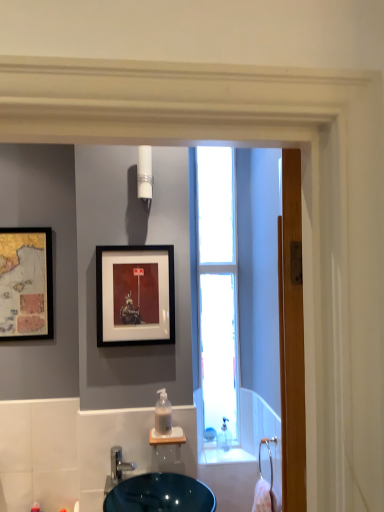
The height and width of the screenshot is (512, 384). Describe the element at coordinates (135, 295) in the screenshot. I see `matte black picture frame at center, which appears as the second picture frame when viewed from the left` at that location.

Measure the distance between point (121,248) and camera.

The depth of point (121,248) is 6.08 feet.

What do you see at coordinates (258, 271) in the screenshot? This screenshot has height=512, width=384. I see `wooden screen door at right` at bounding box center [258, 271].

You are a GUI agent. You are given a task and a screenshot of the screen. Output one action in this format:
    pyautogui.click(x=<x>, y=<y>)
    Task: Click on the white glossy light fixture at upper center
    
    Given the screenshot: What is the action you would take?
    pyautogui.click(x=145, y=176)

Describe the element at coordinates (117, 469) in the screenshot. I see `satin nickel faucet at lower center` at that location.

Where is `matte black picture frame at center, arranged as the 1th picture frame when viewed from the right`? The height and width of the screenshot is (512, 384). matte black picture frame at center, arranged as the 1th picture frame when viewed from the right is located at coordinates (135, 295).

From the image's perspective, is white glossy light fixture at upper center located above or below matte black picture frame at center, marked as the 1th picture frame in a front-to-back arrangement?

Clearly, from the image's perspective, white glossy light fixture at upper center is above matte black picture frame at center, marked as the 1th picture frame in a front-to-back arrangement.

How different are the orientations of white glossy light fixture at upper center and matte black picture frame at center, the second picture frame when ordered from back to front, in degrees?

There is a 4.11-degree angle between the facing directions of white glossy light fixture at upper center and matte black picture frame at center, the second picture frame when ordered from back to front.

Are white glossy light fixture at upper center and matte black picture frame at center, which appears as the second picture frame when viewed from the left, beside each other?

There is a gap between white glossy light fixture at upper center and matte black picture frame at center, which appears as the second picture frame when viewed from the left.

From the picture: Is white glossy light fixture at upper center to the right of matte black picture frame at center, the second picture frame when ordered from back to front, from the viewer's perspective?

Yes, white glossy light fixture at upper center is to the right of matte black picture frame at center, the second picture frame when ordered from back to front.

From the image's perspective, is satin nickel faucet at lower center under matte black picture frame at center, arranged as the 1th picture frame when viewed from the right?

Yes, from the image's perspective, satin nickel faucet at lower center is below matte black picture frame at center, arranged as the 1th picture frame when viewed from the right.

Which is less distant, (114,475) or (161,313)?

The point (114,475) is closer.

Is satin nickel faucet at lower center outside of matte black picture frame at center, which appears as the second picture frame when viewed from the left?

Indeed, satin nickel faucet at lower center is completely outside matte black picture frame at center, which appears as the second picture frame when viewed from the left.

Would you say satin nickel faucet at lower center is a long distance from matte black picture frame at center, which appears as the second picture frame when viewed from the left?

satin nickel faucet at lower center is actually quite close to matte black picture frame at center, which appears as the second picture frame when viewed from the left.

From the image's perspective, who appears lower, satin nickel faucet at lower center or clear plastic soap dispenser at center?

satin nickel faucet at lower center is shown below in the image.

Is satin nickel faucet at lower center inside or outside of clear plastic soap dispenser at center?

satin nickel faucet at lower center is located beyond the bounds of clear plastic soap dispenser at center.

How many degrees apart are the facing directions of satin nickel faucet at lower center and clear plastic soap dispenser at center?

The facing directions of satin nickel faucet at lower center and clear plastic soap dispenser at center are 0.651 degrees apart.

Looking at the image, does satin nickel faucet at lower center seem bigger or smaller compared to clear plastic soap dispenser at center?

satin nickel faucet at lower center is bigger than clear plastic soap dispenser at center.

Is matte black picture frame at center, marked as the 1th picture frame in a front-to-back arrangement, wider than wooden screen door at right?

No.

Which object is further away from the camera, matte black picture frame at center, which appears as the second picture frame when viewed from the left, or wooden screen door at right?

matte black picture frame at center, which appears as the second picture frame when viewed from the left.

In the scene shown: How far apart are matte black picture frame at center, arranged as the 1th picture frame when viewed from the right, and wooden screen door at right?

matte black picture frame at center, arranged as the 1th picture frame when viewed from the right, and wooden screen door at right are 21.81 inches apart from each other.

From a real-world perspective, is matte black picture frame at center, which appears as the second picture frame when viewed from the left, over wooden screen door at right?

Yes, from a real-world perspective, matte black picture frame at center, which appears as the second picture frame when viewed from the left, is over wooden screen door at right

Is matte black picture frame at center, the second picture frame when ordered from back to front, oriented towards transparent glass window at center?

No, matte black picture frame at center, the second picture frame when ordered from back to front, is not turned towards transparent glass window at center.

Considering the positions of points (173, 262) and (232, 369), is point (173, 262) farther from camera compared to point (232, 369)?

No, it is not.

From the image's perspective, which one is positioned higher, matte black picture frame at center, the second picture frame when ordered from back to front, or transparent glass window at center?

transparent glass window at center, from the image's perspective.

Considering the positions of objects matte black picture frame at center, the second picture frame when ordered from back to front, and transparent glass window at center in the image provided, who is more to the right, matte black picture frame at center, the second picture frame when ordered from back to front, or transparent glass window at center?

transparent glass window at center is more to the right.

Consider the image. Is white glossy light fixture at upper center far from clear plastic soap dispenser at center?

That's not correct — white glossy light fixture at upper center is a little close to clear plastic soap dispenser at center.

Can you confirm if white glossy light fixture at upper center is bigger than clear plastic soap dispenser at center?

Correct, white glossy light fixture at upper center is larger in size than clear plastic soap dispenser at center.

Which of these two, white glossy light fixture at upper center or clear plastic soap dispenser at center, is wider?

Wider between the two is clear plastic soap dispenser at center.

The image size is (384, 512). In order to click on window behind the gold metallic map at left, the second picture frame from the front in this screenshot , I will do `click(217, 288)`.

Is gold metallic map at left, which is the 1th picture frame from back to front, oriented away from transparent glass window at center?

No.

From the image's perspective, which one is positioned lower, gold metallic map at left, which is the 1th picture frame in left-to-right order, or transparent glass window at center?

From the image's view, gold metallic map at left, which is the 1th picture frame in left-to-right order, is below.

The height and width of the screenshot is (512, 384). I want to click on the 2nd picture frame below the white glossy light fixture at upper center (from the image's perspective), so pos(135,295).

From a real-world perspective, count 1st picture frames upward from the satin nickel faucet at lower center and point to it. Please provide its 2D coordinates.

[(135, 295)]

Which object lies further to the anchor point wooden screen door at right, transparent glass window at center or clear plastic soap dispenser at center?

clear plastic soap dispenser at center is further to wooden screen door at right.

From the image, which object appears to be nearer to transparent glass window at center, satin nickel faucet at lower center or wooden screen door at right?

The object closer to transparent glass window at center is wooden screen door at right.

When comparing their distances from matte black picture frame at center, which appears as the second picture frame when viewed from the left, does satin nickel faucet at lower center or transparent glass window at center seem further?

The object further to matte black picture frame at center, which appears as the second picture frame when viewed from the left, is satin nickel faucet at lower center.

From the image, which object appears to be nearer to transparent glass window at center, clear plastic soap dispenser at center or satin nickel faucet at lower center?

clear plastic soap dispenser at center is closer to transparent glass window at center.

When comparing their distances from transparent glass window at center, does clear plastic soap dispenser at center or wooden screen door at right seem closer?

wooden screen door at right lies closer to transparent glass window at center than the other object.

Which object lies nearer to the anchor point matte black picture frame at center, the second picture frame when ordered from back to front, wooden screen door at right or clear plastic soap dispenser at center?

clear plastic soap dispenser at center is positioned closer to the anchor matte black picture frame at center, the second picture frame when ordered from back to front.

Based on their spatial positions, is satin nickel faucet at lower center or transparent glass window at center closer to white glossy light fixture at upper center?

transparent glass window at center lies closer to white glossy light fixture at upper center than the other object.

Estimate the real-world distances between objects in this image. Which object is further from matte black picture frame at center, marked as the 1th picture frame in a front-to-back arrangement, wooden screen door at right or gold metallic map at left, which is the 1th picture frame in left-to-right order?

wooden screen door at right lies further to matte black picture frame at center, marked as the 1th picture frame in a front-to-back arrangement, than the other object.

The width and height of the screenshot is (384, 512). In order to click on window between white glossy light fixture at upper center and satin nickel faucet at lower center vertically in this screenshot , I will do `click(217, 288)`.

The height and width of the screenshot is (512, 384). Find the location of `picture frame between gold metallic map at left, which is the 2th picture frame in right-to-left order, and transparent glass window at center`. picture frame between gold metallic map at left, which is the 2th picture frame in right-to-left order, and transparent glass window at center is located at coordinates (135, 295).

What are the coordinates of `soap dispenser between gold metallic map at left, which is the 2th picture frame in right-to-left order, and transparent glass window at center from left to right` in the screenshot? It's located at (163, 414).

At what (x,y) coordinates should I click in order to perform the action: click on tap between wooden screen door at right and gold metallic map at left, which is the 2th picture frame in right-to-left order, along the z-axis. Please return your answer as a coordinate pair (x, y). The height and width of the screenshot is (512, 384). Looking at the image, I should click on (117, 469).